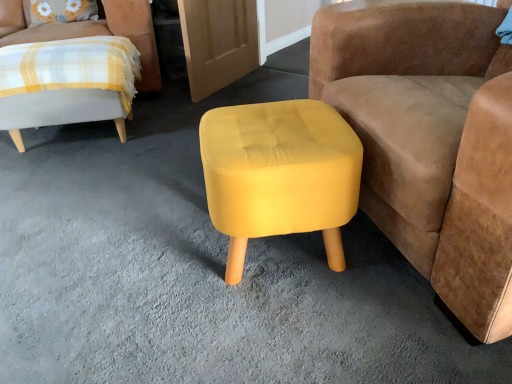
What is the approximate width of plaid fabric chair at left, marked as the second chair in a right-to-left arrangement?

plaid fabric chair at left, marked as the second chair in a right-to-left arrangement, is 3.45 feet in width.

I want to click on plaid fabric chair at left, which is the 1th chair from back to front, so click(91, 31).

Between point (327, 64) and point (44, 10), which one is positioned in front?

The point (327, 64) is closer to the camera.

Does velvet mustard stool at center, which is counted as the 2th chair, starting from the left, have a greater height compared to velvety floral pillow at upper left?

Yes, velvet mustard stool at center, which is counted as the 2th chair, starting from the left, is taller than velvety floral pillow at upper left.

From the image's perspective, which one is positioned lower, velvet mustard stool at center, the second chair in the back-to-front sequence, or velvety floral pillow at upper left?

velvet mustard stool at center, the second chair in the back-to-front sequence.

Is velvet mustard stool at center, the second chair in the back-to-front sequence, directly adjacent to velvety floral pillow at upper left?

No, velvet mustard stool at center, the second chair in the back-to-front sequence, is not beside velvety floral pillow at upper left.

Considering the positions of objects yellow fabric stool at center and velvety floral pillow at upper left in the image provided, who is more to the left, yellow fabric stool at center or velvety floral pillow at upper left?

Positioned to the left is velvety floral pillow at upper left.

Which is in front, point (213, 189) or point (52, 18)?

The point (213, 189) is closer.

Is yellow fabric stool at center touching velvety floral pillow at upper left?

yellow fabric stool at center and velvety floral pillow at upper left are clearly separated.

Is yellow fabric stool at center further to camera compared to velvety floral pillow at upper left?

No, it is in front of velvety floral pillow at upper left.

Is plaid fabric chair at left, which ranks as the second chair in front-to-back order, facing towards velvet mustard stool at center, which is counted as the 1th chair, starting from the front?

No, plaid fabric chair at left, which ranks as the second chair in front-to-back order, is not facing towards velvet mustard stool at center, which is counted as the 1th chair, starting from the front.

From the image's perspective, relative to velvet mustard stool at center, which is counted as the 1th chair, starting from the front, is plaid fabric chair at left, which ranks as the second chair in front-to-back order, above or below?

From the image's perspective, plaid fabric chair at left, which ranks as the second chair in front-to-back order, appears above velvet mustard stool at center, which is counted as the 1th chair, starting from the front.

Can you confirm if plaid fabric chair at left, the 1th chair positioned from the left, is positioned to the left of velvet mustard stool at center, which is counted as the 2th chair, starting from the left?

Correct, you'll find plaid fabric chair at left, the 1th chair positioned from the left, to the left of velvet mustard stool at center, which is counted as the 2th chair, starting from the left.

Could you measure the distance between plaid fabric chair at left, which is the 1th chair from back to front, and velvet mustard stool at center, the second chair in the back-to-front sequence?

5.24 feet.

Identify the location of stool that is under the plaid fabric chair at left, which ranks as the second chair in front-to-back order (from a real-world perspective). The width and height of the screenshot is (512, 384). (280, 174).

Can you tell me how much plaid fabric chair at left, marked as the second chair in a right-to-left arrangement, and yellow fabric stool at center differ in facing direction?

The angular difference between plaid fabric chair at left, marked as the second chair in a right-to-left arrangement, and yellow fabric stool at center is 86.9 degrees.

Which object is positioned more to the right, plaid fabric chair at left, which is the 1th chair from back to front, or yellow fabric stool at center?

Positioned to the right is yellow fabric stool at center.

From a real-world perspective, is yellow fabric stool at center under velvet mustard stool at center, which is counted as the 1th chair, starting from the front?

Indeed, from a real-world perspective, yellow fabric stool at center is positioned beneath velvet mustard stool at center, which is counted as the 1th chair, starting from the front.

Does point (280, 180) appear closer or farther from the camera than point (366, 81)?

Point (280, 180).

Is yellow fabric stool at center not within velvet mustard stool at center, which is counted as the 1th chair, starting from the front?

Absolutely, yellow fabric stool at center is external to velvet mustard stool at center, which is counted as the 1th chair, starting from the front.

From the image's perspective, which one is positioned higher, yellow fabric stool at center or velvet mustard stool at center, arranged as the 1th chair when viewed from the right?

velvet mustard stool at center, arranged as the 1th chair when viewed from the right, appears higher in the image.

From the image's perspective, would you say velvet mustard stool at center, which is counted as the 2th chair, starting from the left, is positioned over plaid fabric chair at left, marked as the second chair in a right-to-left arrangement?

No.

Does point (483, 268) appear closer or farther from the camera than point (143, 66)?

Point (483, 268) is closer to the camera than point (143, 66).

Which object is thinner, velvet mustard stool at center, which is counted as the 1th chair, starting from the front, or plaid fabric chair at left, marked as the second chair in a right-to-left arrangement?

velvet mustard stool at center, which is counted as the 1th chair, starting from the front.

Does velvety floral pillow at upper left turn towards velvet mustard stool at center, which is counted as the 1th chair, starting from the front?

No, velvety floral pillow at upper left is not oriented towards velvet mustard stool at center, which is counted as the 1th chair, starting from the front.

Which is correct: velvety floral pillow at upper left is inside velvet mustard stool at center, which is counted as the 1th chair, starting from the front, or outside of it?

velvety floral pillow at upper left lies outside velvet mustard stool at center, which is counted as the 1th chair, starting from the front.

What's the angular difference between velvety floral pillow at upper left and velvet mustard stool at center, which is counted as the 2th chair, starting from the left,'s facing directions?

The angular difference between velvety floral pillow at upper left and velvet mustard stool at center, which is counted as the 2th chair, starting from the left, is 83 degrees.

Which point is more distant from viewer, (60,6) or (450,59)?

Positioned behind is point (60,6).

What are the coordinates of `pillow on the left of velvet mustard stool at center, which is counted as the 1th chair, starting from the front` in the screenshot? It's located at (61, 11).

This screenshot has width=512, height=384. Identify the location of stool in front of the velvety floral pillow at upper left. (280, 174).

When comparing their distances from plaid fabric chair at left, which ranks as the second chair in front-to-back order, does yellow fabric stool at center or velvety floral pillow at upper left seem further?

yellow fabric stool at center.

When comparing their distances from velvet mustard stool at center, which is counted as the 1th chair, starting from the front, does plaid fabric chair at left, which is the 1th chair from back to front, or velvety floral pillow at upper left seem closer?

plaid fabric chair at left, which is the 1th chair from back to front, is closer to velvet mustard stool at center, which is counted as the 1th chair, starting from the front.

Considering their positions, is velvet mustard stool at center, which is counted as the 2th chair, starting from the left, positioned further to plaid fabric chair at left, which is the 1th chair from back to front, than velvety floral pillow at upper left?

Based on the image, velvet mustard stool at center, which is counted as the 2th chair, starting from the left, appears to be further to plaid fabric chair at left, which is the 1th chair from back to front.

Considering their positions, is velvety floral pillow at upper left positioned further to yellow fabric stool at center than plaid fabric chair at left, which ranks as the second chair in front-to-back order?

velvety floral pillow at upper left is further to yellow fabric stool at center.

Based on their spatial positions, is plaid fabric chair at left, which is the 1th chair from back to front, or velvet mustard stool at center, which is counted as the 2th chair, starting from the left, further from velvety floral pillow at upper left?

velvet mustard stool at center, which is counted as the 2th chair, starting from the left, lies further to velvety floral pillow at upper left than the other object.

Estimate the real-world distances between objects in this image. Which object is closer to yellow fabric stool at center, velvet mustard stool at center, the second chair in the back-to-front sequence, or velvety floral pillow at upper left?

velvet mustard stool at center, the second chair in the back-to-front sequence, is positioned closer to the anchor yellow fabric stool at center.

Based on their spatial positions, is yellow fabric stool at center or plaid fabric chair at left, which ranks as the second chair in front-to-back order, further from velvety floral pillow at upper left?

Based on the image, yellow fabric stool at center appears to be further to velvety floral pillow at upper left.

Which object lies nearer to the anchor point plaid fabric chair at left, marked as the second chair in a right-to-left arrangement, velvet mustard stool at center, which is counted as the 1th chair, starting from the front, or yellow fabric stool at center?

Among the two, yellow fabric stool at center is located nearer to plaid fabric chair at left, marked as the second chair in a right-to-left arrangement.

Where is `stool between velvety floral pillow at upper left and velvet mustard stool at center, which is counted as the 2th chair, starting from the left`? This screenshot has width=512, height=384. stool between velvety floral pillow at upper left and velvet mustard stool at center, which is counted as the 2th chair, starting from the left is located at coordinates (280, 174).

Where is `chair between yellow fabric stool at center and velvety floral pillow at upper left along the z-axis`? The image size is (512, 384). chair between yellow fabric stool at center and velvety floral pillow at upper left along the z-axis is located at coordinates (91, 31).

In order to click on pillow between plaid fabric chair at left, marked as the second chair in a right-to-left arrangement, and velvet mustard stool at center, which is counted as the 2th chair, starting from the left, from left to right in this screenshot , I will do `click(61, 11)`.

Where is `stool between plaid fabric chair at left, which is the 1th chair from back to front, and velvet mustard stool at center, the second chair in the back-to-front sequence, in the horizontal direction`? stool between plaid fabric chair at left, which is the 1th chair from back to front, and velvet mustard stool at center, the second chair in the back-to-front sequence, in the horizontal direction is located at coordinates (280, 174).